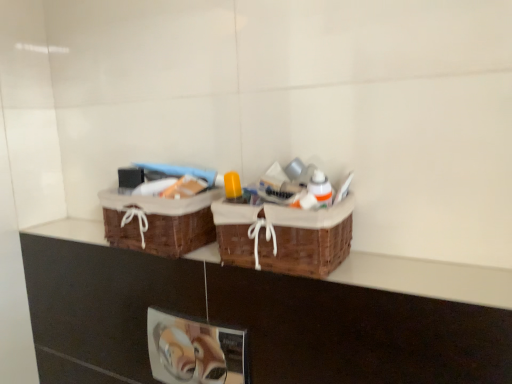
At what (x,y) coordinates should I click in order to perform the action: click on vacant point above woven brown picnic basket at center, the 2th picnic basket positioned from the left (from a real-world perspective). Please return your answer as a coordinate pair (x, y). The width and height of the screenshot is (512, 384). Looking at the image, I should click on (275, 194).